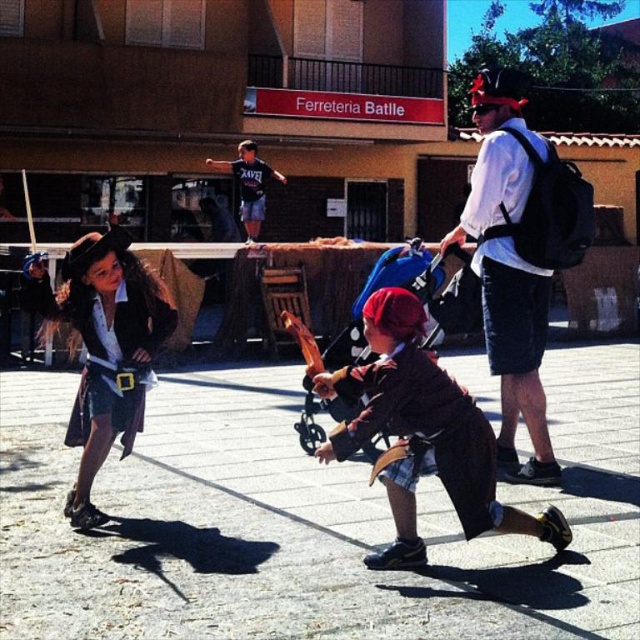
Is point (515, 113) farther from camera compared to point (422, 348)?

Yes, point (515, 113) is behind point (422, 348).

Is point (509, 128) behind point (449, 324)?

No, (509, 128) is closer to viewer.

The height and width of the screenshot is (640, 640). Find the location of `white cotton shirt at upper center`. white cotton shirt at upper center is located at coordinates (508, 268).

Can you confirm if brown woolen coat at center is smaller than white cotton shirt at upper center?

No, brown woolen coat at center is not smaller than white cotton shirt at upper center.

Who is positioned more to the right, brown woolen coat at center or white cotton shirt at upper center?

white cotton shirt at upper center is more to the right.

Between point (346, 422) and point (506, 369), which one is positioned in front?

Point (346, 422) is more forward.

Locate an element on the screen. brown woolen coat at center is located at coordinates (422, 433).

Which is in front, point (496, 506) or point (444, 324)?

Point (496, 506) is in front.

Can you confirm if brown woolen coat at center is positioned to the right of blue fabric stroller at center?

Indeed, brown woolen coat at center is positioned on the right side of blue fabric stroller at center.

This screenshot has height=640, width=640. What do you see at coordinates (422, 433) in the screenshot?
I see `brown woolen coat at center` at bounding box center [422, 433].

You are a GUI agent. You are given a task and a screenshot of the screen. Output one action in this format:
    pyautogui.click(x=<x>, y=<y>)
    Task: Click on the brown woolen coat at center
    This screenshot has width=640, height=640.
    Given the screenshot: What is the action you would take?
    422,433